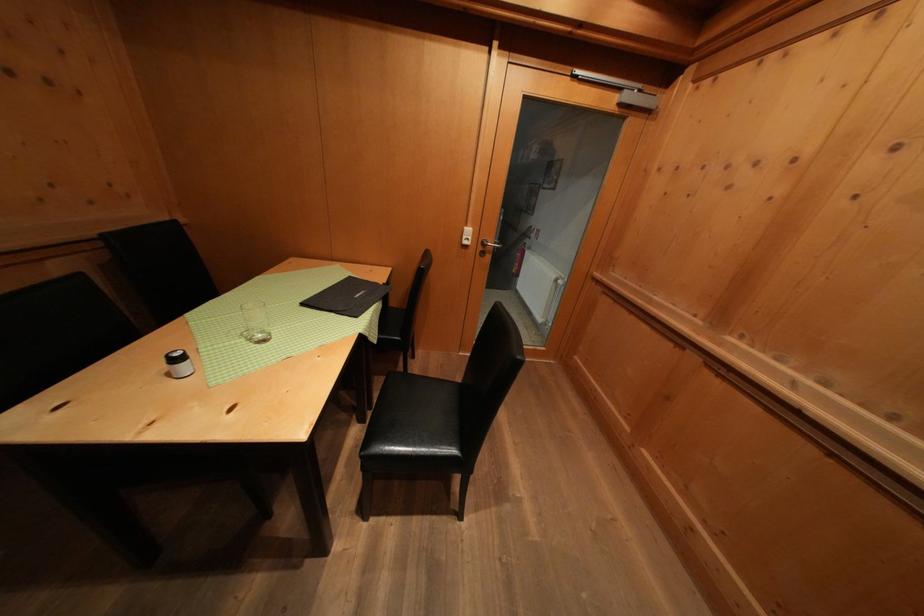
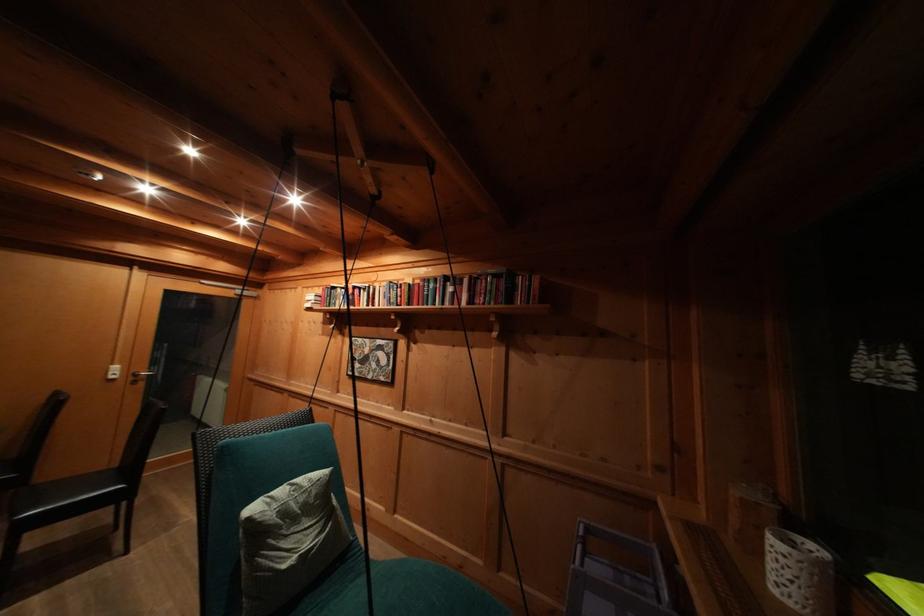
Where in the second image is the point corresponding to point (490, 249) from the first image?

(141, 379)